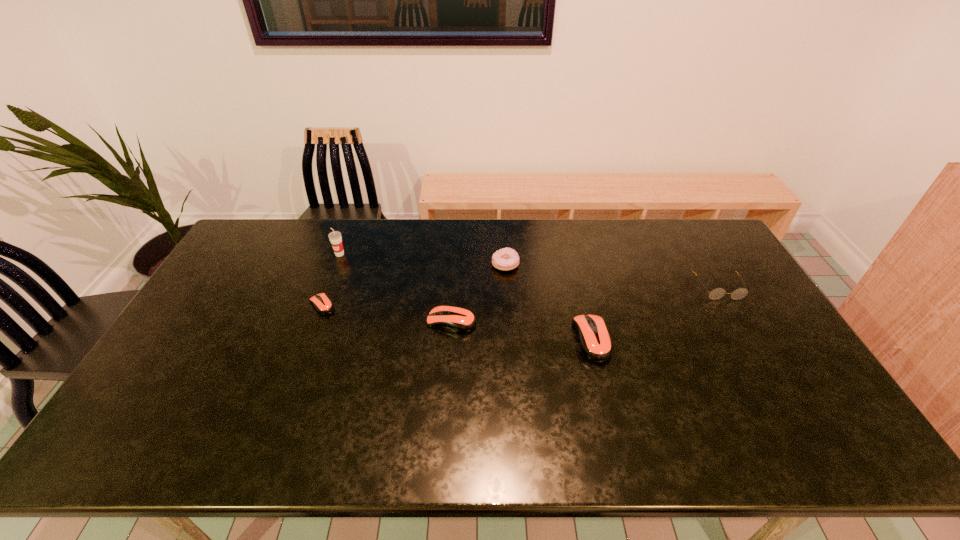
Identify the location of free space for a new computer mouse on the right. (744, 360).